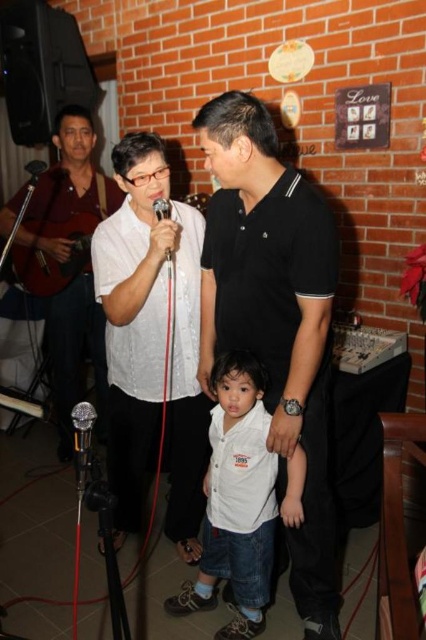
Question: Can you confirm if white matte shirt at center is positioned above matte black microphone at center?

Choices:
 (A) yes
 (B) no

Answer: (B)

Question: Which of the following is the closest to the observer?

Choices:
 (A) white matte shirt at center
 (B) black plastic microphone at center

Answer: (A)

Question: Considering the real-world distances, which object is farthest from the silver metallic microphone at lower left?

Choices:
 (A) white cotton shirt at center
 (B) white matte shirt at center
 (C) black plastic microphone at center
 (D) matte black shirt at center

Answer: (D)

Question: Is white matte shirt at center thinner than white cotton shirt at center?

Choices:
 (A) no
 (B) yes

Answer: (B)

Question: Does white cotton shirt at center appear on the right side of silver metallic microphone at lower left?

Choices:
 (A) yes
 (B) no

Answer: (A)

Question: Which of the following is the closest to the observer?

Choices:
 (A) matte black microphone at center
 (B) white matte shirt at center
 (C) matte black shirt at center

Answer: (B)